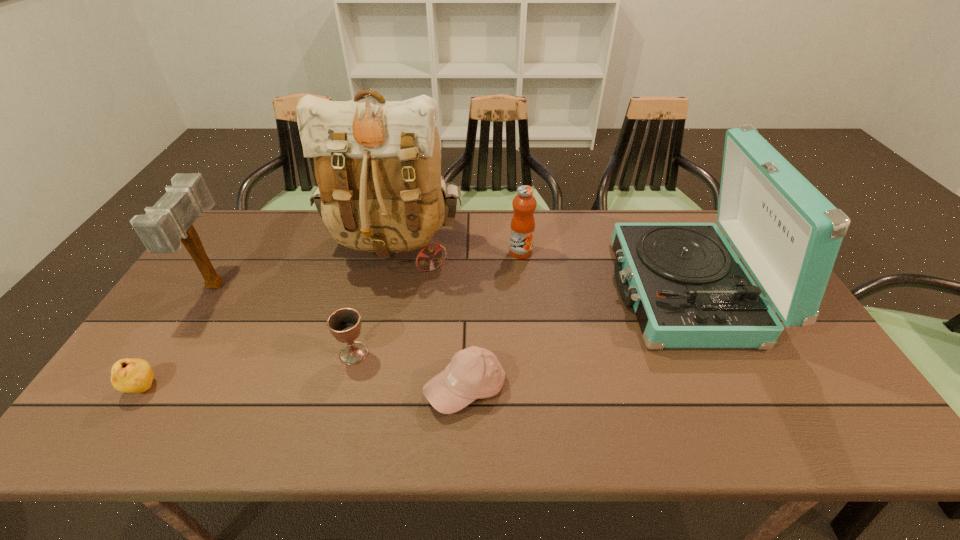
Where is `blank area at the near right corner`? blank area at the near right corner is located at coordinates (819, 441).

The image size is (960, 540). I want to click on free space that is in between the tallest object and the third tallest object, so click(305, 266).

Where is `empty space between the backpack and the baseball cap`? This screenshot has height=540, width=960. empty space between the backpack and the baseball cap is located at coordinates (430, 318).

The width and height of the screenshot is (960, 540). I want to click on vacant area that lies between the tallest object and the fifth shortest object, so click(305, 266).

Find the location of a particular element. vacant region between the baseball cap and the tallest object is located at coordinates (430, 318).

Image resolution: width=960 pixels, height=540 pixels. What are the coordinates of `blank region between the pear and the baseball cap` in the screenshot? It's located at (304, 388).

Locate an element on the screen. This screenshot has height=540, width=960. free area in between the tallest object and the second object from right to left is located at coordinates (458, 250).

Locate an element on the screen. free spot between the pear and the baseball cap is located at coordinates (304, 388).

At what (x,y) coordinates should I click in order to perform the action: click on vacant area that lies between the rightmost object and the pear. Please return your answer as a coordinate pair (x, y). Image resolution: width=960 pixels, height=540 pixels. Looking at the image, I should click on (414, 339).

Find the location of a particular element. free point between the pear and the backpack is located at coordinates (269, 318).